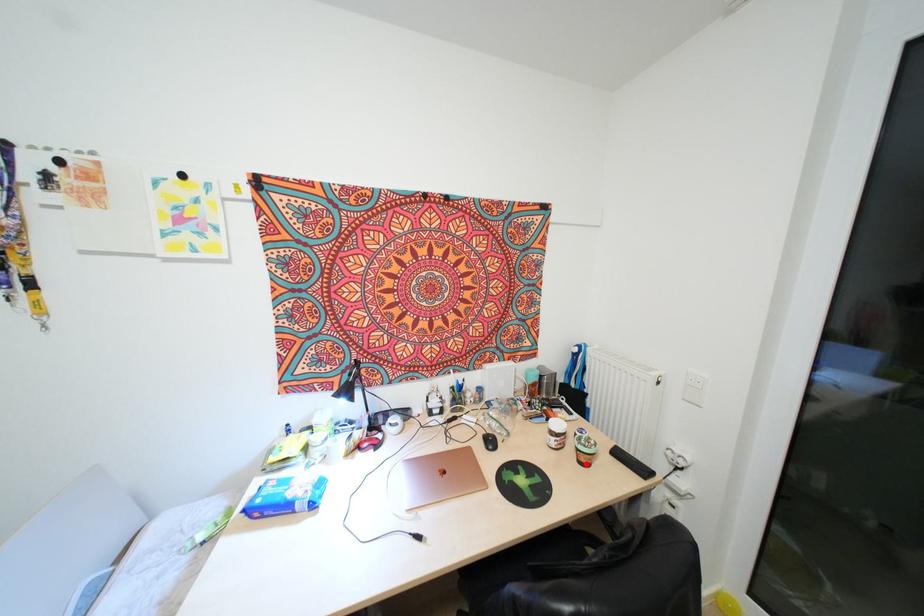
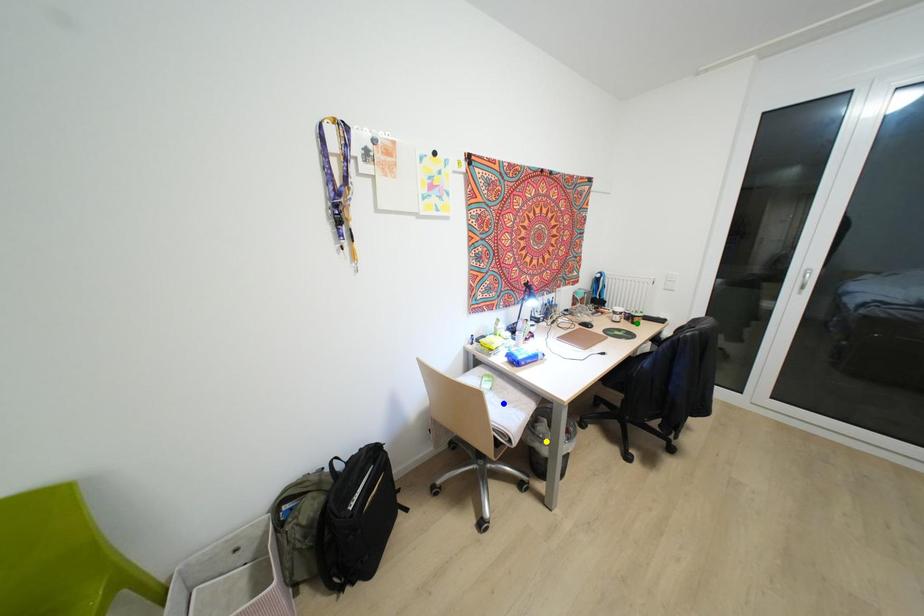
Question: I am providing you with two images of the same scene from different viewpoints. A red point is marked on the first image. You are given multiple points on the second image. Can you choose the point in image 2 that corresponds to the point in image 1?

Choices:
 (A) yellow point
 (B) blue point
 (C) green point

Answer: (C)